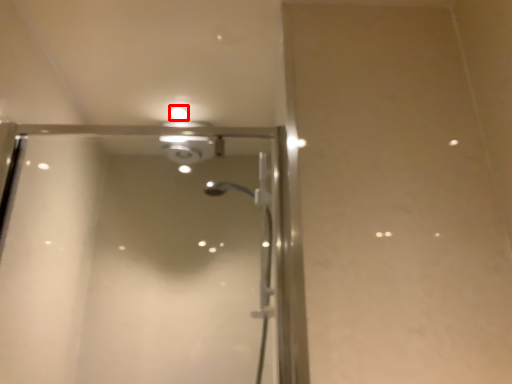
Question: Observing the image, what is the correct spatial positioning of droplight (annotated by the red box) in reference to screen door?

Choices:
 (A) left
 (B) right

Answer: (A)